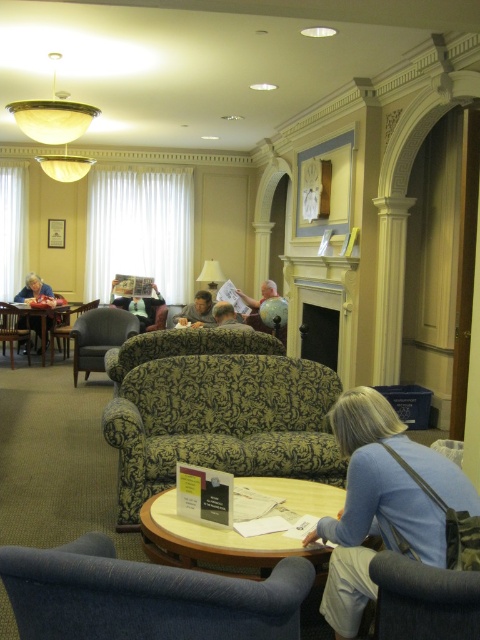
Looking at this image, which is below, blue fabric armchair at lower left or dark green fabric armchair at center?

blue fabric armchair at lower left is lower down.

Identify the location of blue fabric armchair at lower left. This screenshot has width=480, height=640. (144, 596).

Is point (394, 580) in front of point (98, 355)?

Yes, it is.

Between dark gray fabric chair at lower right and dark green fabric armchair at center, which one appears on the left side from the viewer's perspective?

dark green fabric armchair at center

Describe the element at coordinates (423, 600) in the screenshot. The width and height of the screenshot is (480, 640). I see `dark gray fabric chair at lower right` at that location.

This screenshot has width=480, height=640. Find the location of `dark gray fabric chair at lower right`. dark gray fabric chair at lower right is located at coordinates (423, 600).

Find the location of a particular element. green floral fabric couch at center is located at coordinates (220, 422).

Does green floral fabric couch at center appear over blue fabric purse at lower right?

Yes, green floral fabric couch at center is above blue fabric purse at lower right.

Between point (282, 444) and point (456, 465), which one is positioned in front?

Point (456, 465) is in front.

Where is `green floral fabric couch at center`? green floral fabric couch at center is located at coordinates (220, 422).